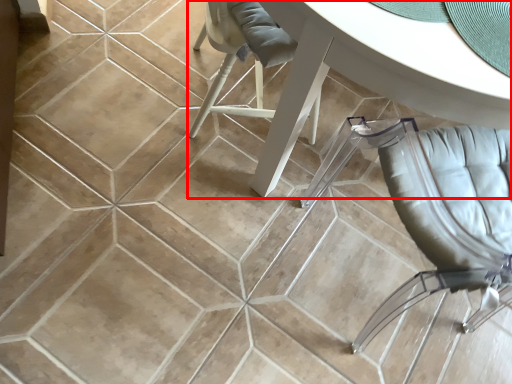
Question: From the image's perspective, what is the correct spatial relationship of table (annotated by the red box) in relation to chair?

Choices:
 (A) above
 (B) below

Answer: (A)